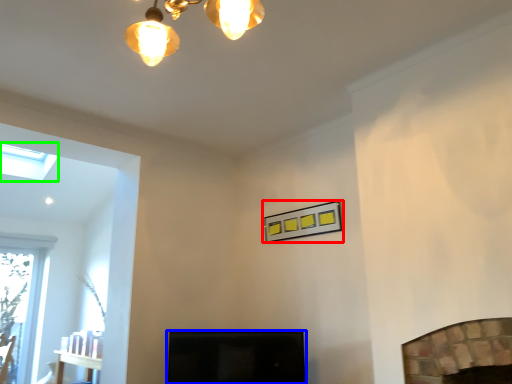
Question: Which object is positioned closest to picture frame (highlighted by a red box)? Select from screen door (highlighted by a blue box) and lamp (highlighted by a green box).

Choices:
 (A) screen door
 (B) lamp

Answer: (A)